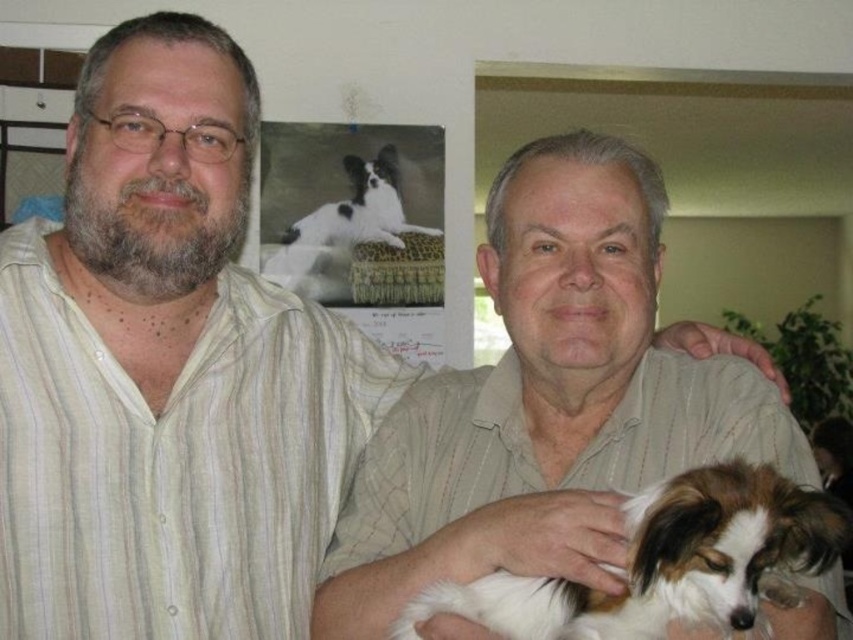
Between point (722, 570) and point (376, 260), which one is positioned behind?

Point (376, 260)

I want to click on white and brown fur dog at center, so click(670, 563).

Based on the photo, can you confirm if light beige striped shirt at center is positioned to the right of black and white fur dog at upper center?

Yes, light beige striped shirt at center is to the right of black and white fur dog at upper center.

Between light beige striped shirt at center and black and white fur dog at upper center, which one has less height?

black and white fur dog at upper center is shorter.

This screenshot has height=640, width=853. What are the coordinates of `light beige striped shirt at center` in the screenshot? It's located at (546, 403).

Does light beige striped shirt at center come in front of white and brown fur dog at center?

No, it is not.

Can you confirm if light beige striped shirt at center is taller than white and brown fur dog at center?

Indeed, light beige striped shirt at center has a greater height compared to white and brown fur dog at center.

Is point (529, 192) positioned before point (776, 481)?

No, it is not.

At what (x,y) coordinates should I click in order to perform the action: click on light beige striped shirt at center. Please return your answer as a coordinate pair (x, y). Image resolution: width=853 pixels, height=640 pixels. Looking at the image, I should click on (546, 403).